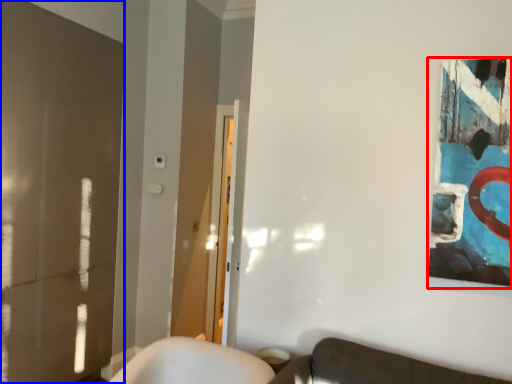
Question: Which point is closer to the camera, picture frame (highlighted by a red box) or glass door (highlighted by a blue box)?

Choices:
 (A) picture frame
 (B) glass door

Answer: (A)